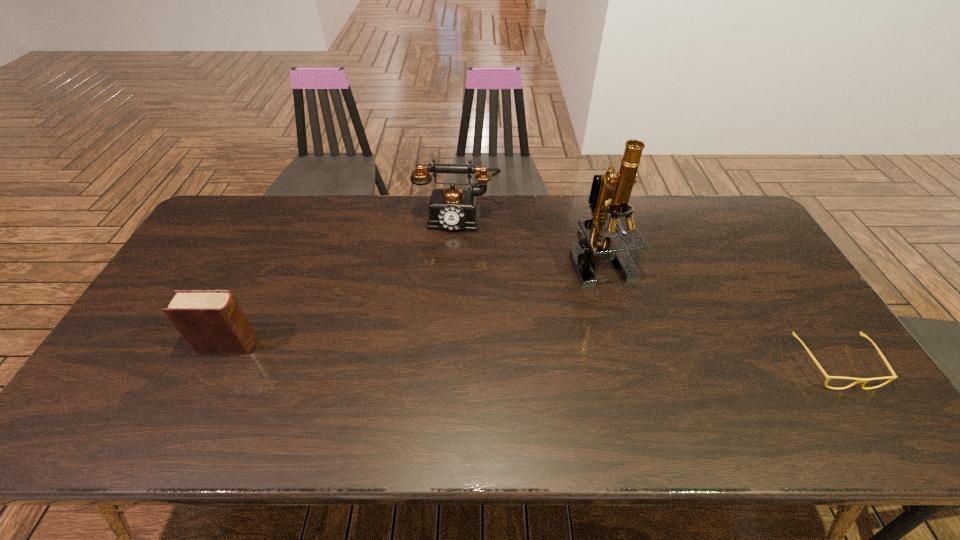
The image size is (960, 540). In order to click on vacant space on the desktop that is between the leftmost object and the shortest object and is positioned on the front of the second object from left to right at the rotary dial in this screenshot , I will do `click(437, 351)`.

Identify the location of free space on the desktop that is between the third tallest object and the spectacles and is positioned at the eyepiece of the microscope. (588, 356).